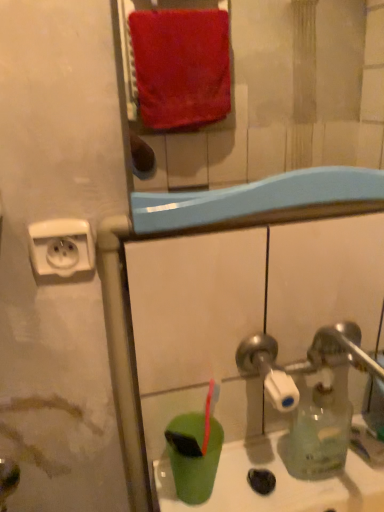
What are the coordinates of `transparent glass bottle at right` in the screenshot? It's located at (286, 437).

What is the approximate width of transparent glass bottle at right?

transparent glass bottle at right is 9.62 inches wide.

Image resolution: width=384 pixels, height=512 pixels. Describe the element at coordinates (286, 437) in the screenshot. I see `transparent glass bottle at right` at that location.

Identify the location of transparent glass bottle at right. The height and width of the screenshot is (512, 384). (286, 437).